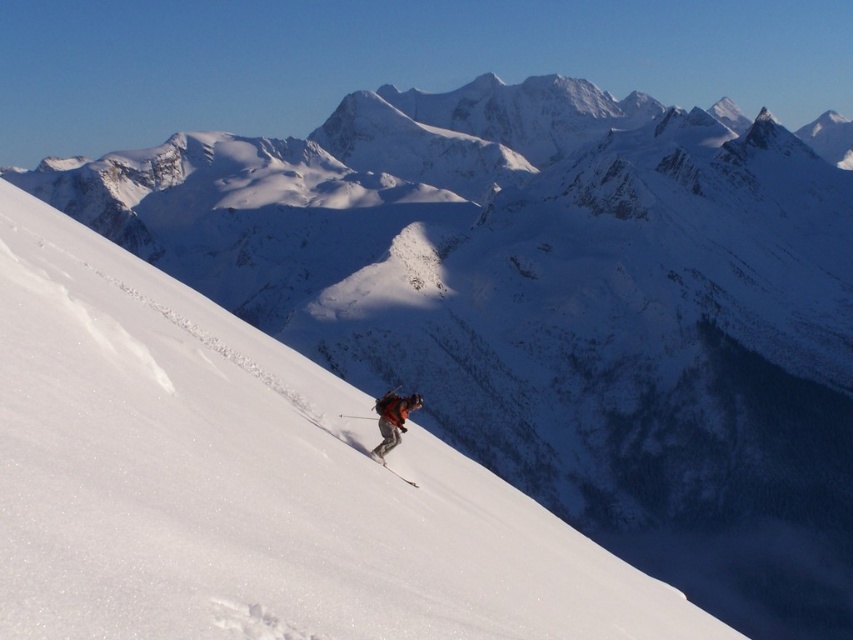
Measure the distance between white snow ski slope at center and matte black ski at center.

white snow ski slope at center and matte black ski at center are 17.09 meters apart from each other.

Between point (140, 460) and point (378, 454), which one is positioned in front?

Point (140, 460) is in front.

Identify the location of white snow ski slope at center. [248, 483].

Does white snow ski slope at center come behind orange fabric jacket at center?

No.

Is point (190, 321) positioned after point (412, 404)?

No.

Measure the distance between point (144, 282) and camera.

A distance of 85.14 meters exists between point (144, 282) and camera.

The image size is (853, 640). In order to click on white snow ski slope at center in this screenshot , I will do `click(248, 483)`.

Can you confirm if orange fabric jacket at center is wider than matte black ski at center?

Yes, orange fabric jacket at center is wider than matte black ski at center.

Does orange fabric jacket at center appear under matte black ski at center?

Yes, orange fabric jacket at center is below matte black ski at center.

Where is `orange fabric jacket at center`? This screenshot has width=853, height=640. orange fabric jacket at center is located at coordinates (393, 419).